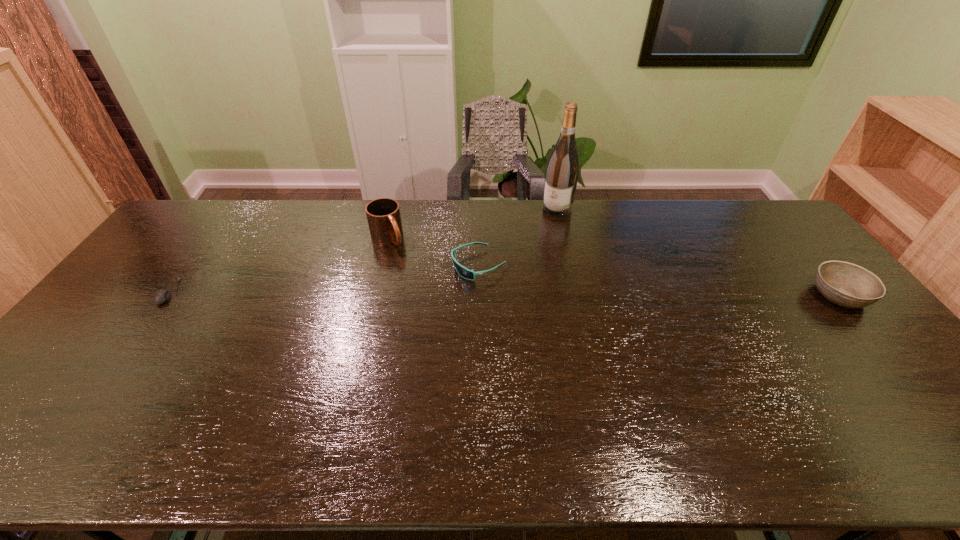
The width and height of the screenshot is (960, 540). Find the location of `vacant space located on the label of the fourth object from left to right`. vacant space located on the label of the fourth object from left to right is located at coordinates (521, 254).

Locate an element on the screen. The width and height of the screenshot is (960, 540). mug located at the far edge is located at coordinates (383, 214).

Image resolution: width=960 pixels, height=540 pixels. What are the coordinates of `wine bottle that is at the far edge` in the screenshot? It's located at (562, 172).

Locate an element on the screen. Image resolution: width=960 pixels, height=540 pixels. object located at the left edge is located at coordinates (160, 297).

Identify the location of object that is at the right edge. (845, 284).

Identify the location of vacant space at the far edge of the desktop. pyautogui.click(x=663, y=213).

You are a GUI agent. You are given a task and a screenshot of the screen. Output one action in this format:
    pyautogui.click(x=<x>, y=<y>)
    Task: Click on the free region at the near edge of the desktop
    
    Given the screenshot: What is the action you would take?
    pyautogui.click(x=535, y=388)

At what (x,y) coordinates should I click in order to perform the action: click on free space at the left edge of the desktop. Please return your answer as a coordinate pair (x, y). Image resolution: width=960 pixels, height=540 pixels. Looking at the image, I should click on (169, 265).

Find the location of a particular element. Image resolution: width=960 pixels, height=540 pixels. vacant space at the right edge is located at coordinates (800, 246).

This screenshot has width=960, height=540. In the image, there is a desktop. Identify the location of free region at the far left corner. (187, 233).